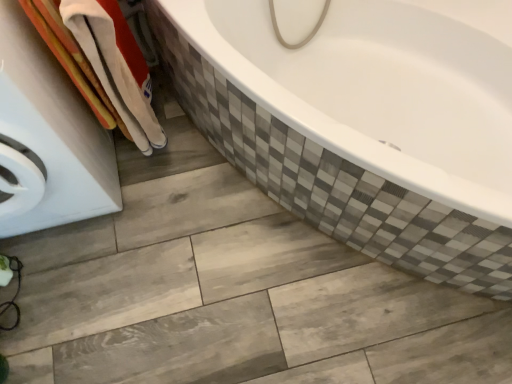
Question: Does white cotton towel at left have a greater height compared to white glossy washing machine at left?

Choices:
 (A) no
 (B) yes

Answer: (A)

Question: Is white cotton towel at left not inside white glossy washing machine at left?

Choices:
 (A) yes
 (B) no

Answer: (A)

Question: From the image's perspective, does white cotton towel at left appear lower than white glossy washing machine at left?

Choices:
 (A) yes
 (B) no

Answer: (B)

Question: Is white cotton towel at left with white glossy washing machine at left?

Choices:
 (A) no
 (B) yes

Answer: (A)

Question: From a real-world perspective, is white cotton towel at left on top of white glossy washing machine at left?

Choices:
 (A) no
 (B) yes

Answer: (B)

Question: Is white cotton towel at left smaller than white glossy washing machine at left?

Choices:
 (A) yes
 (B) no

Answer: (A)

Question: Is white glossy washing machine at left aimed at white cotton towel at left?

Choices:
 (A) yes
 (B) no

Answer: (B)

Question: From a real-world perspective, is white glossy washing machine at left physically below white cotton towel at left?

Choices:
 (A) yes
 (B) no

Answer: (A)

Question: Is white cotton towel at left completely or partially inside white glossy washing machine at left?

Choices:
 (A) no
 (B) yes

Answer: (A)

Question: Is white glossy washing machine at left to the right of white cotton towel at left from the viewer's perspective?

Choices:
 (A) yes
 (B) no

Answer: (B)

Question: Is white cotton towel at left at the back of white glossy washing machine at left?

Choices:
 (A) no
 (B) yes

Answer: (A)

Question: Is white glossy washing machine at left smaller than white cotton towel at left?

Choices:
 (A) no
 (B) yes

Answer: (A)

Question: Is white glossy washing machine at left situated inside white cotton towel at left or outside?

Choices:
 (A) outside
 (B) inside

Answer: (A)